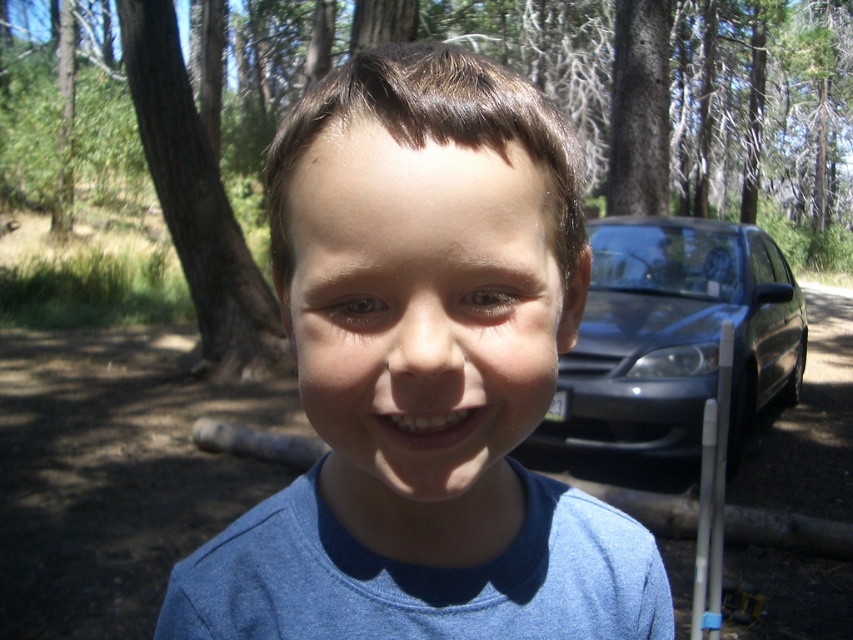
Question: Can you confirm if blue cotton shirt at center is positioned below brown rough tree at left?

Choices:
 (A) yes
 (B) no

Answer: (A)

Question: Which object appears farthest from the camera in this image?

Choices:
 (A) blue cotton shirt at center
 (B) brown rough tree at left
 (C) satin blue sedan at right

Answer: (B)

Question: Which point is farther to the camera?

Choices:
 (A) brown rough tree at left
 (B) satin blue sedan at right
 (C) blue cotton shirt at center

Answer: (A)

Question: Where is blue cotton shirt at center located in relation to brown rough tree at left in the image?

Choices:
 (A) left
 (B) right

Answer: (B)

Question: Which is farther from the satin blue sedan at right?

Choices:
 (A) brown rough tree at left
 (B) blue cotton shirt at center

Answer: (B)

Question: Observing the image, what is the correct spatial positioning of blue cotton shirt at center in reference to brown rough tree at left?

Choices:
 (A) above
 (B) below

Answer: (B)